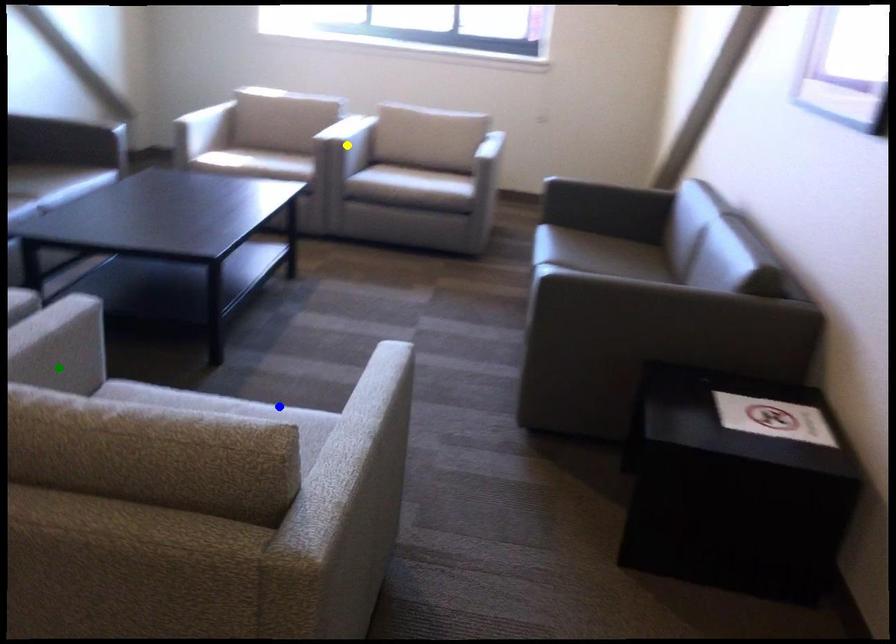
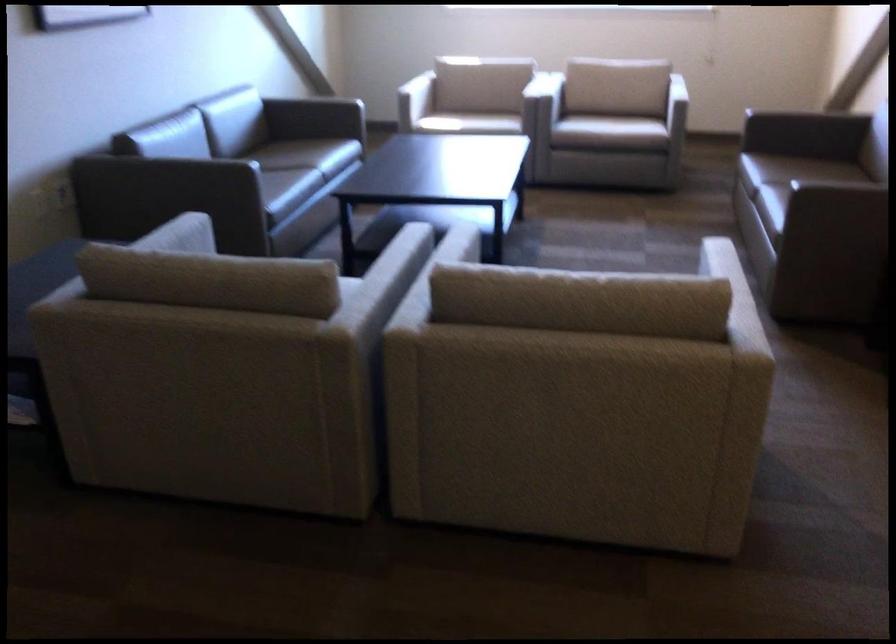
I am providing you with two images of the same scene from different viewpoints. Three points are marked in image1. Which point corresponds to a part or object that is occluded in image2?In image1, three points are marked. Which of them correspond to a part or object that is occluded in image2?Among the three points shown in image1, which one corresponds to a part or object that is no longer visible due to occlusion in image2?

green point, yellow point, blue point